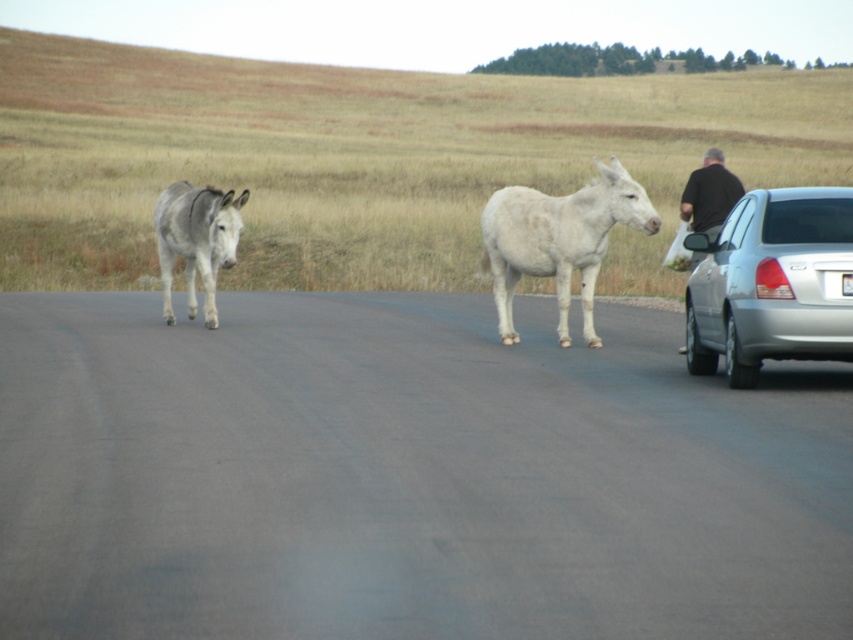
You are a photographer positioned on the road. You notice the silver metallic sedan at right and the black fabric at right in the distance. Which object appears closer to you based on their sizes?

The silver metallic sedan at right appears closer to you because it is smaller than the black fabric at right, and smaller objects in the distance can appear closer due to perspective.

You are a photographer positioned at the point with coordinates point (772, 284). You want to capture a photo of the silver metallic sedan at right. Which direction should you face to ensure the silver metallic sedan at right is in your view?

The point (772, 284) is where the silver metallic sedan at right is located, so facing any direction from that point will not include the silver metallic sedan at right in the view.

You are a farmer who needs to secure the black fabric at right to the gray matte donkey at left. Given their positions, can you directly attach the fabric to the donkey without moving either?

The black fabric at right is behind the gray matte donkey at left, so you cannot directly attach it to the donkey without moving either since the fabric is positioned behind the animal.